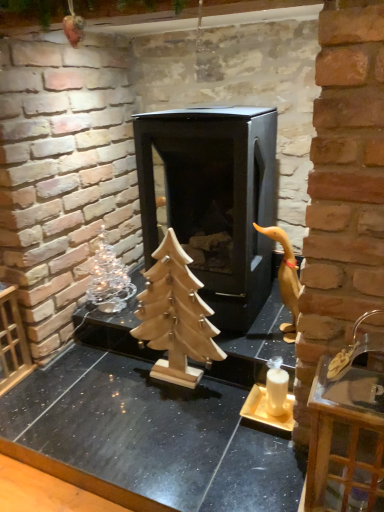
Find the location of `blank area beneath wooden christmas tree at center (from a real-world perspective)`. blank area beneath wooden christmas tree at center (from a real-world perspective) is located at coordinates (181, 385).